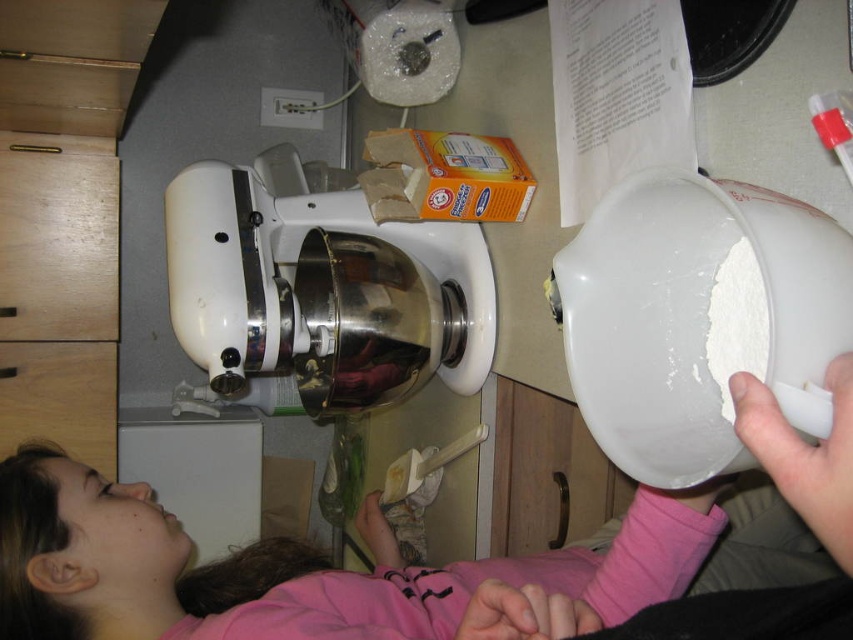
Can you confirm if white glossy mixer at center is smaller than wooden at left?

Actually, white glossy mixer at center might be larger than wooden at left.

Does point (390, 264) lie in front of point (106, 317)?

Yes, point (390, 264) is in front of point (106, 317).

I want to click on white glossy mixer at center, so click(x=322, y=291).

Which is below, wooden at left or wooden drawer at lower left?

Positioned lower is wooden drawer at lower left.

Can you confirm if wooden at left is positioned below wooden drawer at lower left?

No, wooden at left is not below wooden drawer at lower left.

You are a GUI agent. You are given a task and a screenshot of the screen. Output one action in this format:
    pyautogui.click(x=<x>, y=<y>)
    Task: Click on the wooden at left
    The width and height of the screenshot is (853, 640).
    Given the screenshot: What is the action you would take?
    (x=57, y=237)

Can you confirm if white glossy mixer at center is shorter than wooden drawer at lower left?

In fact, white glossy mixer at center may be taller than wooden drawer at lower left.

Is white glossy mixer at center further to the viewer compared to wooden drawer at lower left?

No.

Describe the element at coordinates (322, 291) in the screenshot. I see `white glossy mixer at center` at that location.

Where is `white glossy mixer at center`? white glossy mixer at center is located at coordinates (322, 291).